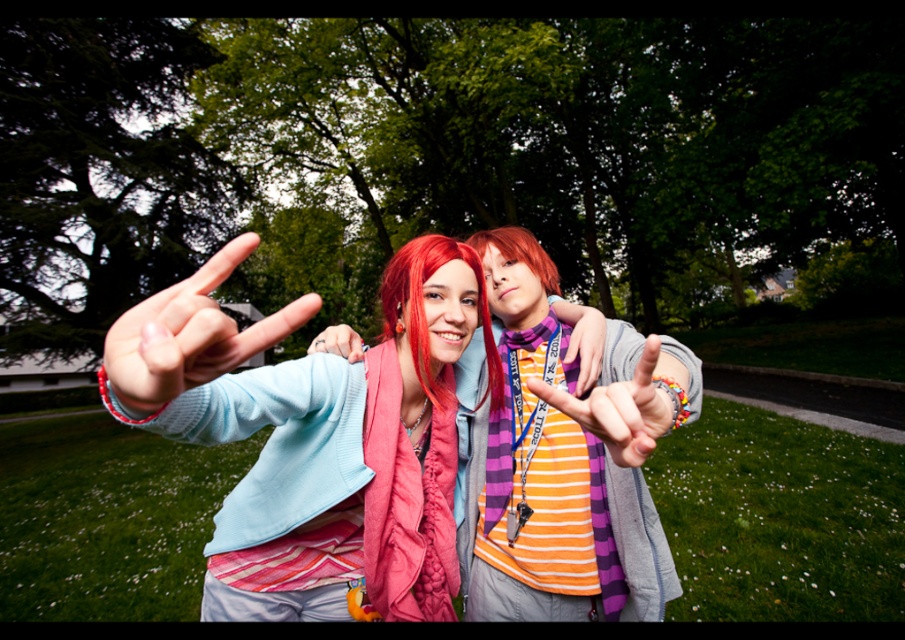
You are a photographer trying to capture a candid shot of the two people in the park. You notice the knitted pink scarf at center and the matte blue hand at center. Which object is positioned lower in the image?

The knitted pink scarf at center is located below the matte blue hand at center, so the knitted pink scarf at center is positioned lower in the image.

You are a photographer setting up for a group photo. You notice the orange striped shirt at center and the matte black hand at center in your frame. Which object should you adjust to ensure both are visible in the photo?

The orange striped shirt at center is not as tall as the matte black hand at center. To ensure both are visible, you should lower the camera angle slightly so that the shorter orange striped shirt at center is still in frame while accommodating the taller matte black hand at center.

You are a photographer trying to capture a clear shot of both the purple striped scarf at center and the vivid red hair at center. Based on their positions, which object should you focus on first to ensure both are in frame?

The purple striped scarf at center is taller than the vivid red hair at center, so focusing on the purple striped scarf at center first will ensure the vivid red hair at center is also in frame since it is shorter.